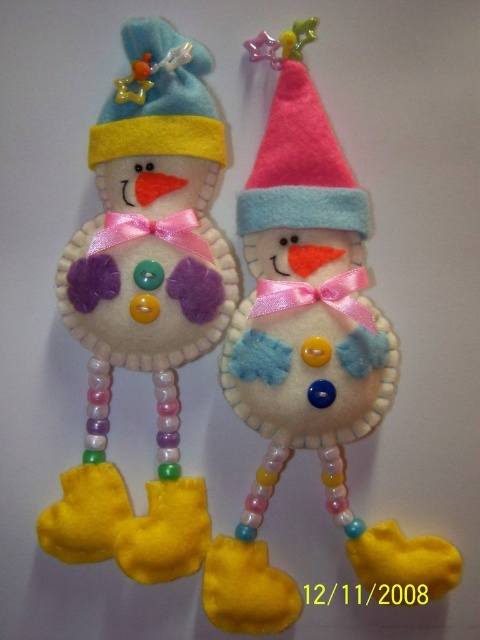
Is point (287, 52) more distant than point (188, 252)?

No, it is not.

Locate an element on the screen. The height and width of the screenshot is (640, 480). felt snowman at center is located at coordinates (308, 356).

You are a GUI agent. You are given a task and a screenshot of the screen. Output one action in this format:
    pyautogui.click(x=<x>, y=<y>)
    Task: Click on the felt snowman at center
    
    Given the screenshot: What is the action you would take?
    pyautogui.click(x=308, y=356)